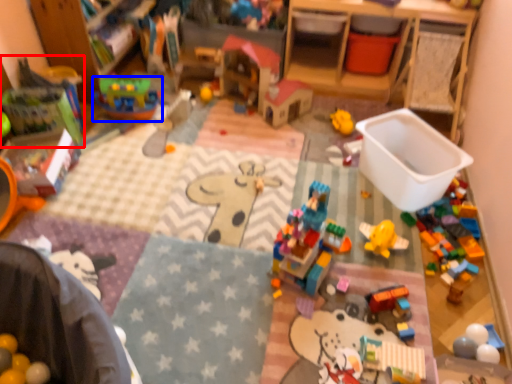
Question: Which object is closer to the camera taking this photo, toy (highlighted by a red box) or toy (highlighted by a blue box)?

Choices:
 (A) toy
 (B) toy

Answer: (A)